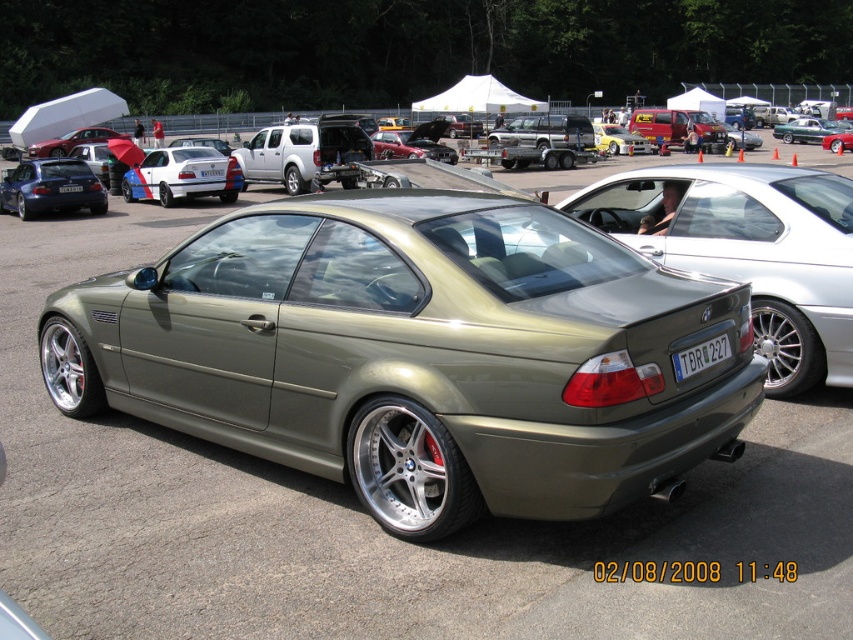
Measure the distance between point (335, 148) and camera.

Point (335, 148) and camera are 20.76 meters apart from each other.

Between point (309, 164) and point (70, 170), which one is positioned behind?

Point (309, 164)

This screenshot has width=853, height=640. I want to click on silver metallic truck at center, so click(x=306, y=154).

Can you confirm if silver metallic truck at center is smaller than white matte hatchback at center?

Actually, silver metallic truck at center might be larger than white matte hatchback at center.

Is silver metallic truck at center closer to camera compared to white matte hatchback at center?

Yes, it is.

You are a GUI agent. You are given a task and a screenshot of the screen. Output one action in this format:
    pyautogui.click(x=<x>, y=<y>)
    Task: Click on the silver metallic truck at center
    The image size is (853, 640).
    Given the screenshot: What is the action you would take?
    pyautogui.click(x=306, y=154)

Is white plastic license plate at center smaller than white plastic license plate at rear?

Actually, white plastic license plate at center might be larger than white plastic license plate at rear.

The width and height of the screenshot is (853, 640). What do you see at coordinates (213, 173) in the screenshot?
I see `white plastic license plate at center` at bounding box center [213, 173].

Looking at this image, who is more forward, (222,172) or (68,189)?

Point (68,189)

The image size is (853, 640). I want to click on white plastic license plate at center, so click(x=213, y=173).